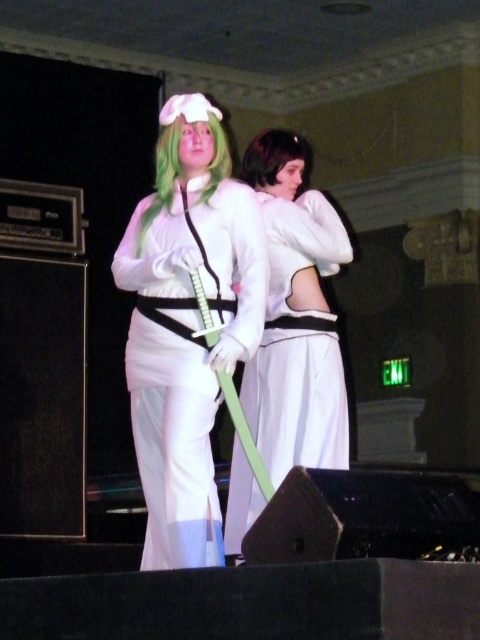
You are a photographer trying to adjust your camera focus. You see two points in the image labeled as point (178,164) and point (181,131). Which point should you focus on if you want to capture the part of the costume that is closer to the camera?

You should focus on point (178,164) because it is closer to the camera compared to point (181,131).

You are a photographer adjusting the lighting for a photo shoot. The main light needs to be placed at a specific coordinate to highlight the green silky hair at center. What are the coordinates where you should position the light?

The green silky hair at center is located at coordinates point [179,156], so you should position the light at that coordinate to highlight it.